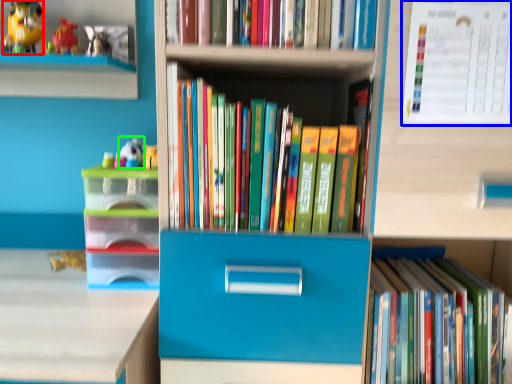
Question: Which object is positioned closest to toy (highlighted by a red box)? Select from paperback book (highlighted by a blue box) and toy (highlighted by a green box).

Choices:
 (A) paperback book
 (B) toy

Answer: (B)